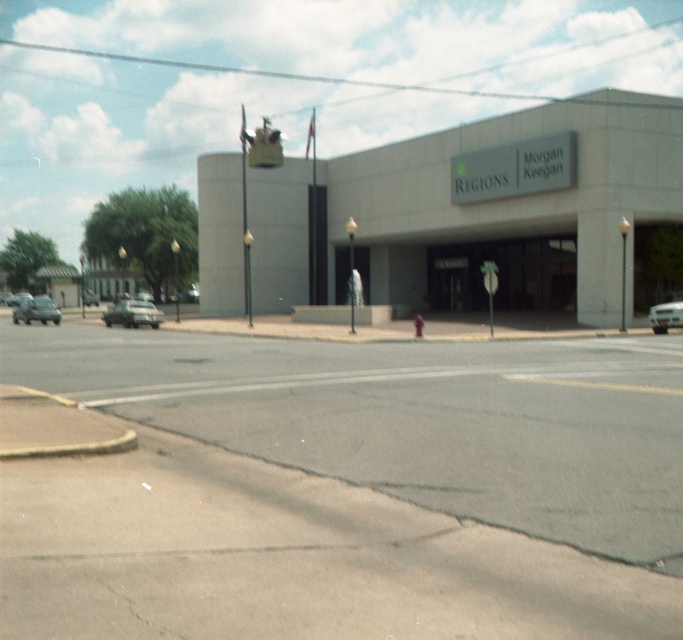
This screenshot has width=683, height=640. I want to click on shiny silver sedan at left, so click(x=133, y=314).

This screenshot has width=683, height=640. Find the location of `shiny silver sedan at left`. shiny silver sedan at left is located at coordinates (133, 314).

Does silver metallic sedan at left have a lesser height compared to silver metallic car at right?

In fact, silver metallic sedan at left may be taller than silver metallic car at right.

At what (x,y) coordinates should I click in order to perform the action: click on silver metallic sedan at left. Please return your answer as a coordinate pair (x, y). This screenshot has height=640, width=683. Looking at the image, I should click on (36, 310).

I want to click on silver metallic sedan at left, so click(x=36, y=310).

Between point (137, 321) and point (31, 316), which one is positioned in front?

Point (137, 321)

Can you confirm if shiny silver sedan at left is thinner than silver metallic sedan at left?

Indeed, shiny silver sedan at left has a lesser width compared to silver metallic sedan at left.

Looking at this image, who is more distant from viewer, (124, 308) or (44, 308)?

Positioned behind is point (44, 308).

What are the coordinates of `shiny silver sedan at left` in the screenshot? It's located at (133, 314).